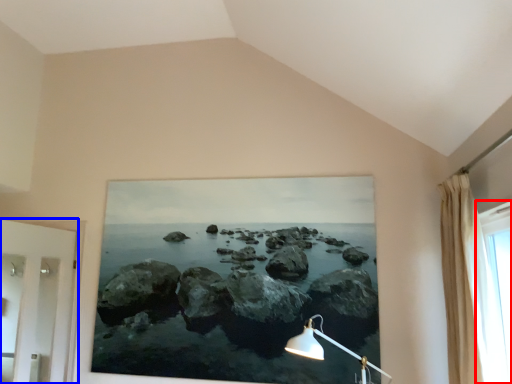
Question: Which object appears closest to the camera in this image, window (highlighted by a red box) or door (highlighted by a blue box)?

Choices:
 (A) window
 (B) door

Answer: (A)